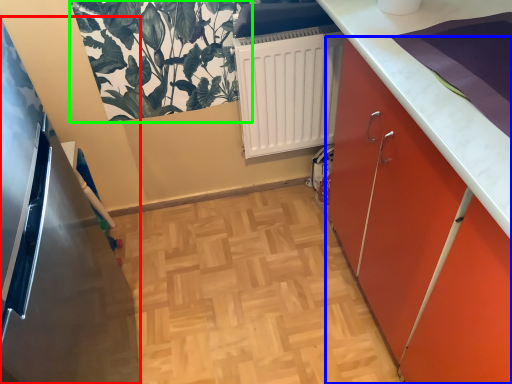
Question: Estimate the real-world distances between objects in this image. Which object is farther from appliance (highlighted by a red box), cabinetry (highlighted by a blue box) or plant (highlighted by a green box)?

Choices:
 (A) cabinetry
 (B) plant

Answer: (A)